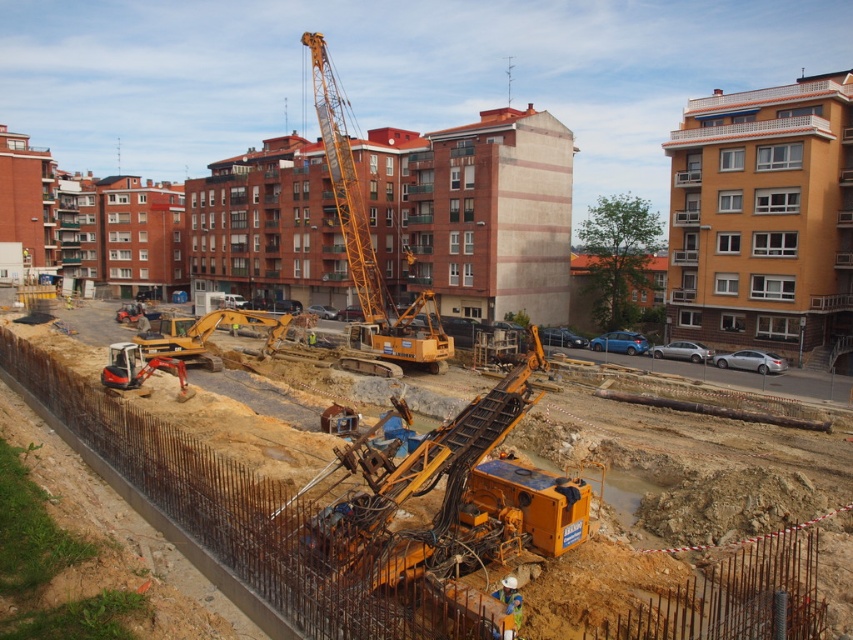
Question: Does yellow metallic construction equipment at center have a larger size compared to yellow metallic crane at upper center?

Choices:
 (A) yes
 (B) no

Answer: (A)

Question: Does yellow metallic construction equipment at center appear on the left side of yellow metallic crane at upper center?

Choices:
 (A) no
 (B) yes

Answer: (B)

Question: Can you confirm if yellow metallic construction equipment at center is thinner than yellow metallic crane at upper center?

Choices:
 (A) no
 (B) yes

Answer: (A)

Question: Which object is positioned farthest from the yellow metallic crane at upper center?

Choices:
 (A) yellow metallic drilling rig at center
 (B) yellow metallic construction equipment at center

Answer: (A)

Question: Which of these objects is positioned closest to the yellow metallic construction equipment at center?

Choices:
 (A) yellow metallic drilling rig at center
 (B) yellow metallic crane at upper center

Answer: (A)

Question: Based on their relative distances, which object is nearer to the yellow metallic crane at upper center?

Choices:
 (A) yellow metallic drilling rig at center
 (B) yellow metallic construction equipment at center

Answer: (B)